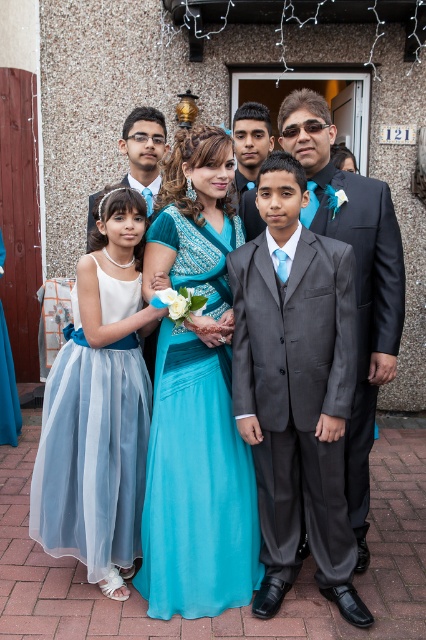
You are a photographer trying to adjust the lighting for a group photo. The scene includes a woman in a turquoise satin dress at center and a man in a matte black suit at center. Which of the two outfits might require more careful lighting adjustments due to its material properties?

The turquoise satin dress at center has a glossy surface, so it might require more careful lighting adjustments compared to the matte black suit at center which has a non reflective surface.

You are standing 10 feet away from the turquoise satin dress at center. Can you comfortably reach out and touch it without moving your feet?

The distance of turquoise satin dress at center from viewer is 10.01 feet, so no, you cannot comfortably reach it without moving your feet since it is slightly farther than 10 feet.